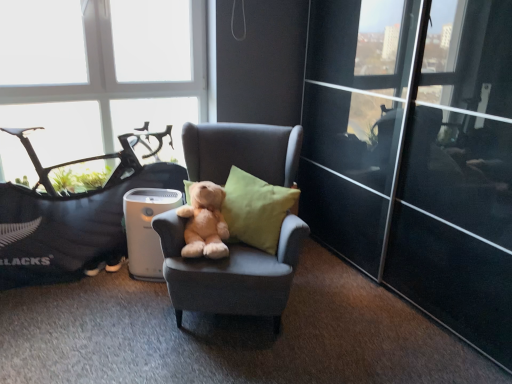
The image size is (512, 384). I want to click on vacant point to the right of matte gray armchair at center, so click(357, 316).